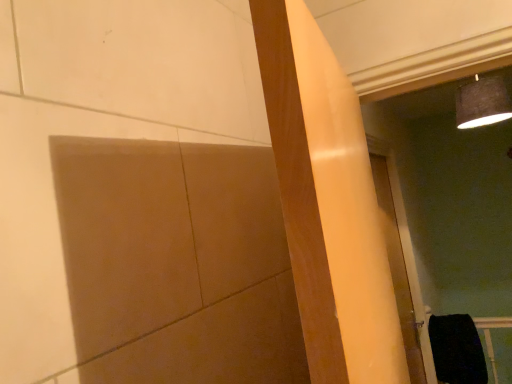
Question: From a real-world perspective, is black fabric at lower right beneath white glossy door at right?

Choices:
 (A) no
 (B) yes

Answer: (B)

Question: Is black fabric at lower right not within white glossy door at right?

Choices:
 (A) no
 (B) yes

Answer: (B)

Question: Is black fabric at lower right further to the viewer compared to white glossy door at right?

Choices:
 (A) no
 (B) yes

Answer: (B)

Question: Is black fabric at lower right to the right of white glossy door at right from the viewer's perspective?

Choices:
 (A) no
 (B) yes

Answer: (B)

Question: From a real-world perspective, does black fabric at lower right stand above white glossy door at right?

Choices:
 (A) yes
 (B) no

Answer: (B)

Question: Is black fabric at lower right smaller than white glossy door at right?

Choices:
 (A) no
 (B) yes

Answer: (B)

Question: Is white glossy door at right behind black fabric at lower right?

Choices:
 (A) no
 (B) yes

Answer: (A)

Question: Is white glossy door at right oriented towards black fabric at lower right?

Choices:
 (A) yes
 (B) no

Answer: (B)

Question: From the image's perspective, is white glossy door at right located above black fabric at lower right?

Choices:
 (A) no
 (B) yes

Answer: (B)

Question: Is white glossy door at right taller than black fabric at lower right?

Choices:
 (A) no
 (B) yes

Answer: (B)

Question: Is black fabric at lower right inside white glossy door at right?

Choices:
 (A) no
 (B) yes

Answer: (A)

Question: Is white glossy door at right next to black fabric at lower right?

Choices:
 (A) yes
 (B) no

Answer: (B)

Question: Considering their positions, is white glossy door at right located in front of or behind black fabric at lower right?

Choices:
 (A) front
 (B) behind

Answer: (A)